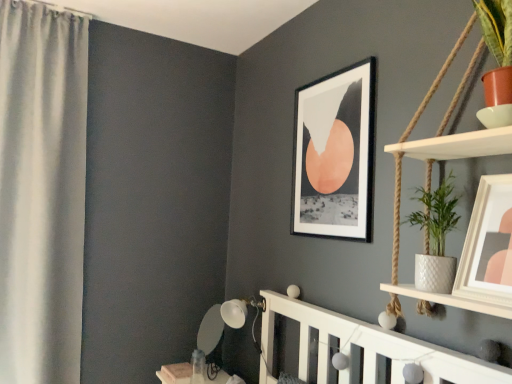
Question: Should I look upward or downward to see white textured pot at right?

Choices:
 (A) down
 (B) up

Answer: (A)

Question: Would you say white fabric curtain at left is part of black matte picture frame at upper center, acting as the first picture frame starting from the back,'s contents?

Choices:
 (A) no
 (B) yes

Answer: (A)

Question: Can you confirm if black matte picture frame at upper center, which appears as the second picture frame when viewed from the front, is taller than white fabric curtain at left?

Choices:
 (A) no
 (B) yes

Answer: (A)

Question: Is black matte picture frame at upper center, which is the second picture frame from right to left, to the right of white fabric curtain at left from the viewer's perspective?

Choices:
 (A) yes
 (B) no

Answer: (A)

Question: From the image's perspective, is black matte picture frame at upper center, which appears as the second picture frame when viewed from the front, on white fabric curtain at left?

Choices:
 (A) yes
 (B) no

Answer: (A)

Question: Does black matte picture frame at upper center, which is the second picture frame from right to left, have a lesser width compared to white fabric curtain at left?

Choices:
 (A) no
 (B) yes

Answer: (B)

Question: Are white fabric curtain at left and white textured pot at right located far from each other?

Choices:
 (A) no
 (B) yes

Answer: (B)

Question: Is white fabric curtain at left next to white textured pot at right and touching it?

Choices:
 (A) yes
 (B) no

Answer: (B)

Question: Is the position of white fabric curtain at left more distant than that of white textured pot at right?

Choices:
 (A) no
 (B) yes

Answer: (B)

Question: Can you confirm if white fabric curtain at left is taller than white textured pot at right?

Choices:
 (A) yes
 (B) no

Answer: (A)

Question: Considering the relative sizes of white fabric curtain at left and white textured pot at right in the image provided, is white fabric curtain at left wider than white textured pot at right?

Choices:
 (A) yes
 (B) no

Answer: (A)

Question: Is white fabric curtain at left bigger than white textured pot at right?

Choices:
 (A) yes
 (B) no

Answer: (A)

Question: Could you tell me if white textured pot at right is turned towards matte white picture frame at upper right, the first picture frame viewed from the right?

Choices:
 (A) yes
 (B) no

Answer: (B)